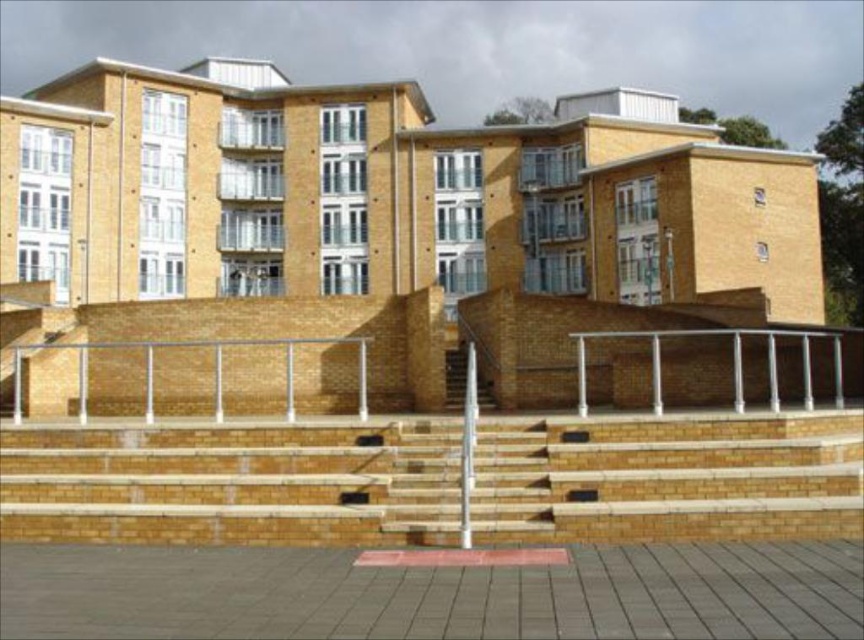
You are a maintenance worker needing to replace a part for the silver metallic rail at center. You have a tool that can only handle objects smaller than the smooth concrete stairs at center. Will your tool be sufficient?

The silver metallic rail at center is bigger than the smooth concrete stairs at center, so the tool may not be sufficient as it can only handle objects smaller than the smooth concrete stairs at center.

You are standing at the base of the building and looking up at the two points marked on the facade. Which point, point [831,339] or point [488,380], is closer to your eyes?

Point [831,339] is further to the viewer than point [488,380], so the point closer to your eyes would be point [488,380].

You are a maintenance worker needing to secure the silver metallic rail at center and the smooth concrete stairs at center. From the perspective of someone facing the building, which object is on the right side?

The silver metallic rail at center is positioned on the right side of the smooth concrete stairs at center, so when facing the building, the silver metallic rail at center is on the right side.